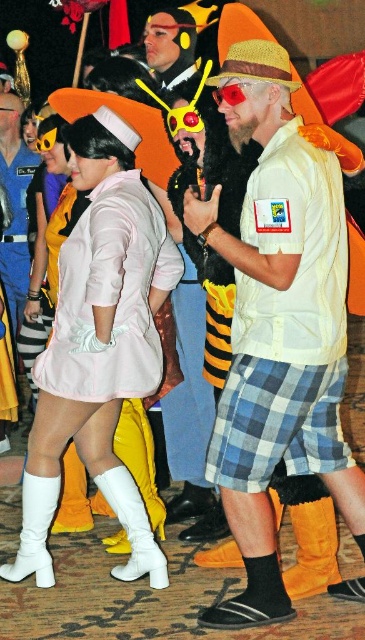
Question: Which point is closer to the camera?

Choices:
 (A) matte white shirt at center
 (B) white matte boots at lower left
 (C) light pink satin dress at center
 (D) shiny plastic helmet at center

Answer: (A)

Question: Which is farther from the white matte boot at lower left?

Choices:
 (A) white matte boots at lower left
 (B) orange suede boot at lower left
 (C) matte white shirt at center
 (D) white leather boot at lower left

Answer: (C)

Question: Considering the relative positions of white leather boot at lower left and orange suede boot at lower left in the image provided, where is white leather boot at lower left located with respect to orange suede boot at lower left?

Choices:
 (A) right
 (B) left

Answer: (B)

Question: Does white leather boot at lower left have a larger size compared to shiny plastic helmet at center?

Choices:
 (A) yes
 (B) no

Answer: (B)

Question: Can you confirm if white matte boots at lower left is wider than orange suede boot at lower left?

Choices:
 (A) yes
 (B) no

Answer: (A)

Question: Which of the following is the closest to the observer?

Choices:
 (A) 44,486
 (B) 183,42

Answer: (A)